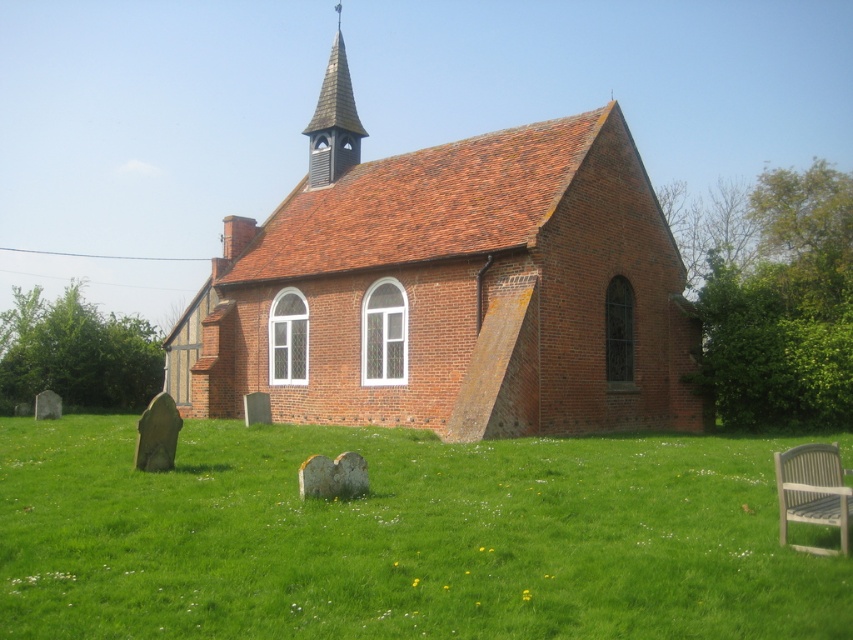
Question: Which of the following is the closest to the observer?

Choices:
 (A) (529, 636)
 (B) (502, 284)
 (C) (815, 465)
 (D) (314, 168)

Answer: (A)

Question: From the image, what is the correct spatial relationship of green grass at lower center in relation to wooden spire at upper center?

Choices:
 (A) below
 (B) above

Answer: (A)

Question: Which object appears closest to the camera in this image?

Choices:
 (A) red brick church at center
 (B) light gray plastic chair at lower right
 (C) wooden spire at upper center
 (D) green grass at lower center

Answer: (D)

Question: Can you confirm if green grass at lower center is thinner than light gray plastic chair at lower right?

Choices:
 (A) no
 (B) yes

Answer: (A)

Question: Does green grass at lower center lie behind wooden spire at upper center?

Choices:
 (A) no
 (B) yes

Answer: (A)

Question: Estimate the real-world distances between objects in this image. Which object is farther from the light gray plastic chair at lower right?

Choices:
 (A) green grass at lower center
 (B) wooden spire at upper center
 (C) red brick church at center

Answer: (B)